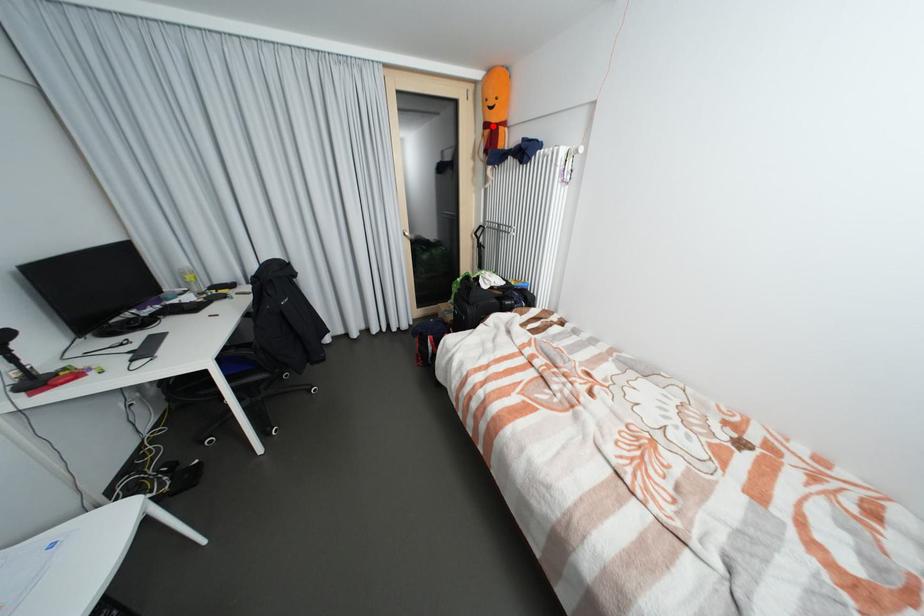
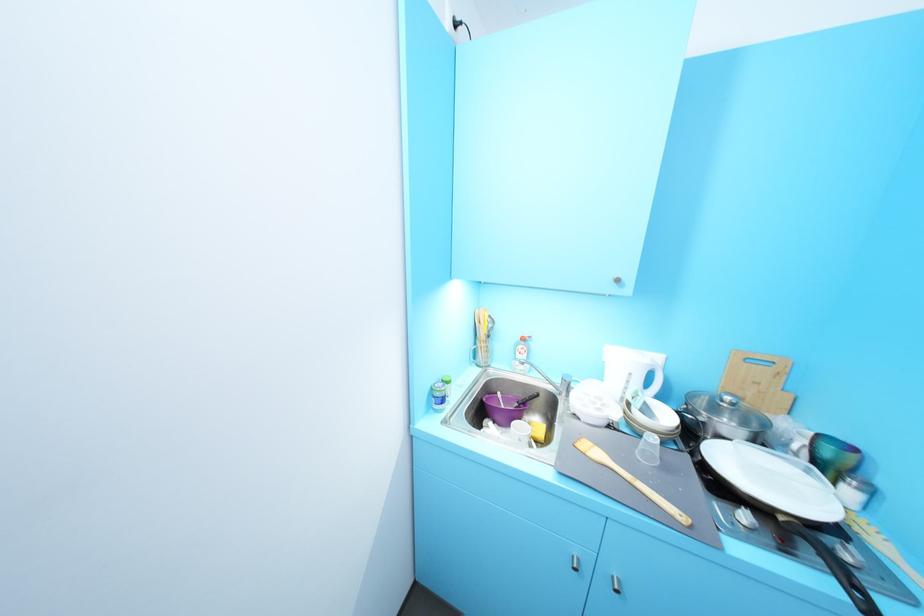
Question: I am providing you with two images of the same scene from different viewpoints. A red point is marked on the first image. Is the red point's position out of view in image 2?

Choices:
 (A) Yes
 (B) No

Answer: (A)